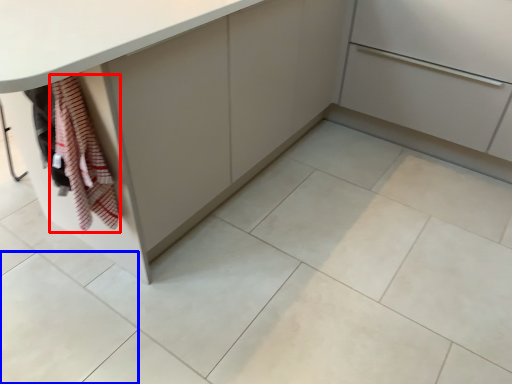
Question: Among these objects, which one is nearest to the camera, blanket (highlighted by a red box) or ceramic tile (highlighted by a blue box)?

Choices:
 (A) blanket
 (B) ceramic tile

Answer: (A)